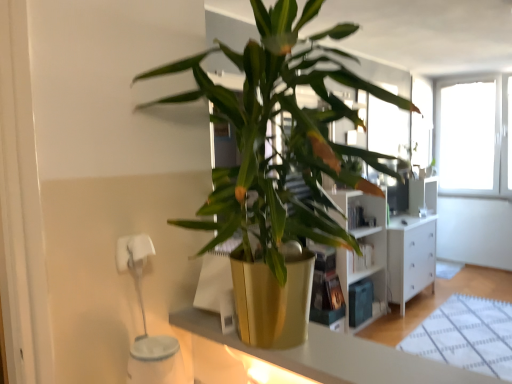
The image size is (512, 384). I want to click on gold metallic pot at center, so tap(275, 156).

What do you see at coordinates (275, 156) in the screenshot? I see `gold metallic pot at center` at bounding box center [275, 156].

What do you see at coordinates (335, 355) in the screenshot? I see `metallic gold pot at center` at bounding box center [335, 355].

Measure the distance between point (360,345) and camera.

The distance of point (360,345) from camera is 37.36 inches.

The image size is (512, 384). In order to click on metallic gold pot at center in this screenshot , I will do `click(335, 355)`.

This screenshot has width=512, height=384. What are the coordinates of `gold metallic pot at center` in the screenshot? It's located at [275, 156].

In the scene shown: Does gold metallic pot at center appear on the right side of metallic gold pot at center?

Yes, gold metallic pot at center is to the right of metallic gold pot at center.

Is gold metallic pot at center positioned before metallic gold pot at center?

Yes, the depth of gold metallic pot at center is less than that of metallic gold pot at center.

Which is in front, point (216, 215) or point (347, 352)?

Point (347, 352)

From the image's perspective, between gold metallic pot at center and metallic gold pot at center, which one is located above?

gold metallic pot at center, from the image's perspective.

From a real-world perspective, which is physically above, gold metallic pot at center or metallic gold pot at center?

From a 3D spatial view, gold metallic pot at center is above.

Does gold metallic pot at center have a greater width compared to metallic gold pot at center?

Yes.

Which of these two, gold metallic pot at center or metallic gold pot at center, stands shorter?

Standing shorter between the two is metallic gold pot at center.

Between gold metallic pot at center and metallic gold pot at center, which one has smaller size?

metallic gold pot at center is smaller.

Is gold metallic pot at center situated inside metallic gold pot at center or outside?

gold metallic pot at center exists outside the volume of metallic gold pot at center.

Is gold metallic pot at center beside metallic gold pot at center?

No, gold metallic pot at center is not in contact with metallic gold pot at center.

Is gold metallic pot at center aimed at metallic gold pot at center?

No.

Find the location of a particular element. Image resolution: width=512 pixels, height=384 pixels. houseplant in front of the metallic gold pot at center is located at coordinates coord(275,156).

Is metallic gold pot at center to the left or to the right of gold metallic pot at center in the image?

metallic gold pot at center is positioned on gold metallic pot at center's left side.

Based on the photo, which object is further away from the camera, metallic gold pot at center or gold metallic pot at center?

metallic gold pot at center is further from the camera.

Is point (387, 347) less distant than point (263, 181)?

No, it is behind (263, 181).

From the image's perspective, would you say metallic gold pot at center is positioned over gold metallic pot at center?

No.

Looking at this image, from a real-world perspective, is metallic gold pot at center positioned under gold metallic pot at center based on gravity?

Yes, from a real-world perspective, metallic gold pot at center is below gold metallic pot at center.

Considering the sizes of objects metallic gold pot at center and gold metallic pot at center in the image provided, who is wider, metallic gold pot at center or gold metallic pot at center?

gold metallic pot at center is wider.

Between metallic gold pot at center and gold metallic pot at center, which one has more height?

gold metallic pot at center is taller.

Who is bigger, metallic gold pot at center or gold metallic pot at center?

gold metallic pot at center.

Is metallic gold pot at center located outside gold metallic pot at center?

Yes, metallic gold pot at center is outside of gold metallic pot at center.

Is metallic gold pot at center far from gold metallic pot at center?

metallic gold pot at center is actually quite close to gold metallic pot at center.

Could you tell me if metallic gold pot at center is facing gold metallic pot at center?

No, metallic gold pot at center is not turned towards gold metallic pot at center.

Based on the photo, what's the angular difference between metallic gold pot at center and gold metallic pot at center's facing directions?

The angle between the facing direction of metallic gold pot at center and the facing direction of gold metallic pot at center is 1.2 degrees.

You are a GUI agent. You are given a task and a screenshot of the screen. Output one action in this format:
    pyautogui.click(x=<x>, y=<y>)
    Task: Click on the houseplant above the metallic gold pot at center (from a real-world perspective)
    The image size is (512, 384).
    Given the screenshot: What is the action you would take?
    click(275, 156)

Where is `counter top on the left of gold metallic pot at center`? The width and height of the screenshot is (512, 384). counter top on the left of gold metallic pot at center is located at coordinates (335, 355).

Locate an element on the screen. The height and width of the screenshot is (384, 512). counter top below the gold metallic pot at center (from a real-world perspective) is located at coordinates (335, 355).